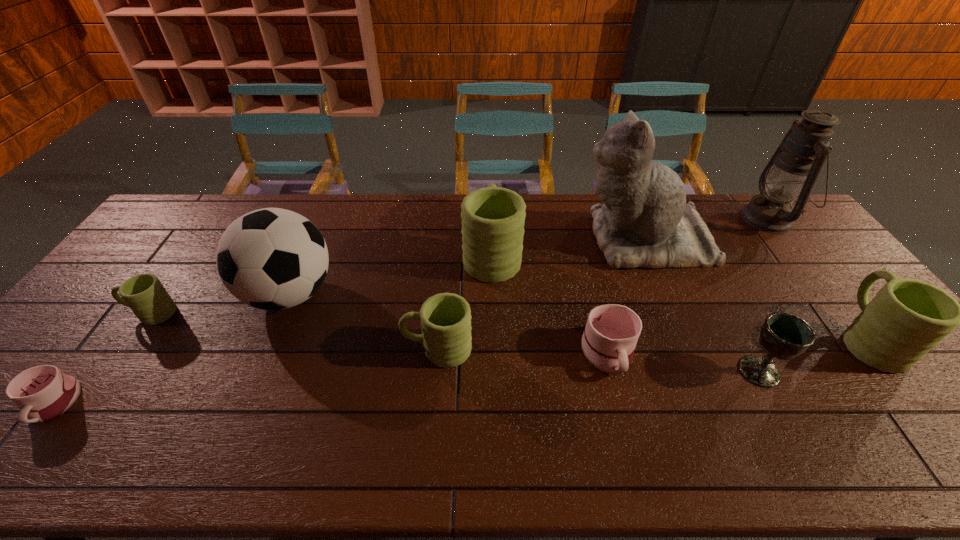
This screenshot has width=960, height=540. What are the coordinates of `free space at the near edge of the desktop` in the screenshot? It's located at (339, 437).

You are a GUI agent. You are given a task and a screenshot of the screen. Output one action in this format:
    pyautogui.click(x=<x>, y=<y>)
    Task: Click on the free space at the right edge of the desktop
    The width and height of the screenshot is (960, 540).
    Given the screenshot: What is the action you would take?
    pyautogui.click(x=815, y=292)

Locate an element on the screen. The width and height of the screenshot is (960, 540). free space at the far right corner of the desktop is located at coordinates (745, 194).

What are the coordinates of `unoccupied position between the black soccer ball and the rightmost mug` in the screenshot? It's located at 579,316.

The image size is (960, 540). What are the coordinates of `free space between the oil lamp and the smaller white mug` in the screenshot? It's located at (411, 312).

Locate an element on the screen. free point between the oil lamp and the leftmost green mug is located at coordinates (460, 266).

The width and height of the screenshot is (960, 540). I want to click on free point between the shortest mug and the black soccer ball, so click(171, 349).

Identify the location of free space between the cat and the seventh shortest object. The width and height of the screenshot is (960, 540). (567, 247).

In order to click on empty space that is in between the cat and the fourth tallest object in this screenshot , I will do `click(567, 247)`.

Where is `empty space between the second mug from right to left and the brown oil lamp`? This screenshot has height=540, width=960. empty space between the second mug from right to left and the brown oil lamp is located at coordinates (688, 286).